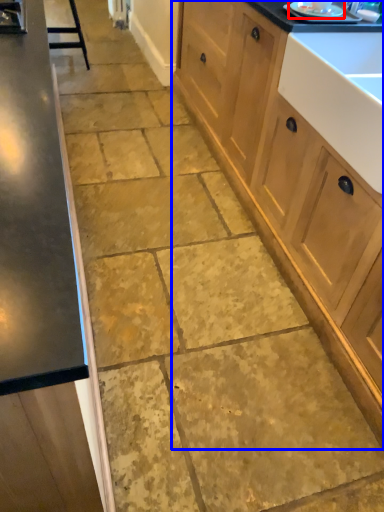
Question: Which point is closer to the camera, appliance (highlighted by a red box) or cabinetry (highlighted by a blue box)?

Choices:
 (A) appliance
 (B) cabinetry

Answer: (B)